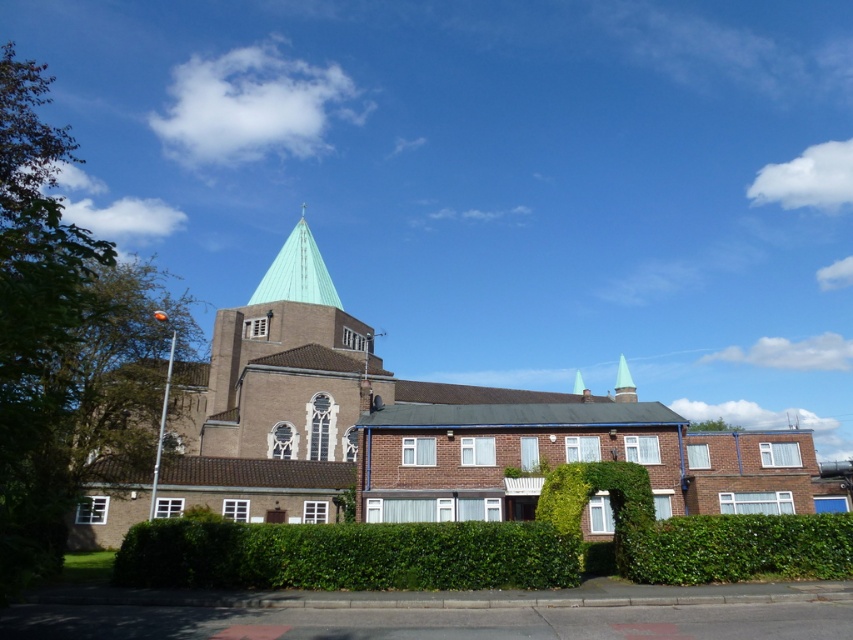
Question: Estimate the real-world distances between objects in this image. Which object is closer to the green metallic spire at upper center?

Choices:
 (A) brown brick church at center
 (B) green glass spire at upper center
 (C) green leafy hedge at lower right

Answer: (A)

Question: Can you confirm if brown brick church at center is positioned above green metallic spire at upper center?

Choices:
 (A) yes
 (B) no

Answer: (B)

Question: Does brown brick church at center appear on the right side of green leafy hedge at lower right?

Choices:
 (A) yes
 (B) no

Answer: (A)

Question: Which of the following is the farthest from the observer?

Choices:
 (A) green leafy hedge at lower right
 (B) green glass spire at upper center

Answer: (B)

Question: Which of the following is the closest to the observer?

Choices:
 (A) (274, 300)
 (B) (634, 400)

Answer: (A)

Question: Does green leafy hedge at lower right appear on the right side of green glass spire at upper center?

Choices:
 (A) no
 (B) yes

Answer: (A)